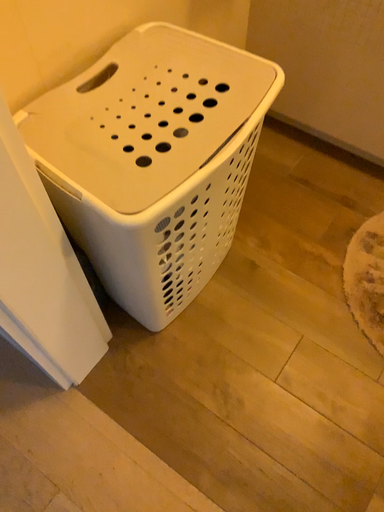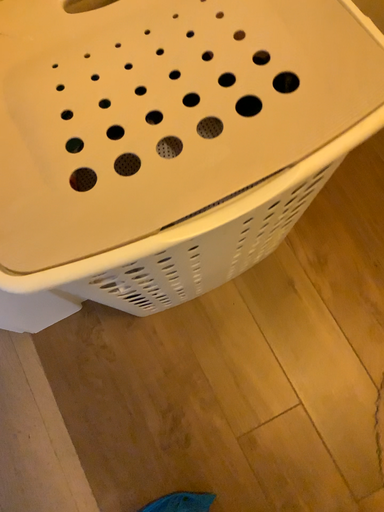
Question: Which way did the camera rotate in the video?

Choices:
 (A) rotated right
 (B) rotated left

Answer: (B)